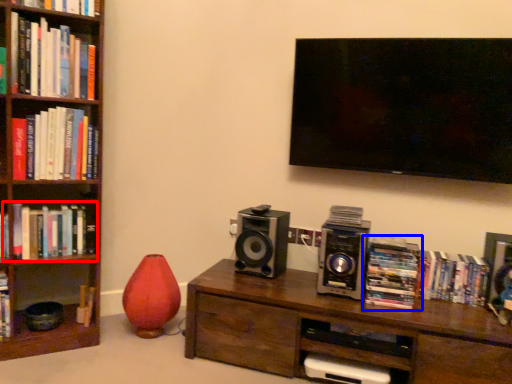
Question: Which of the following is the farthest to the observer, book (highlighted by a red box) or book (highlighted by a blue box)?

Choices:
 (A) book
 (B) book

Answer: (A)